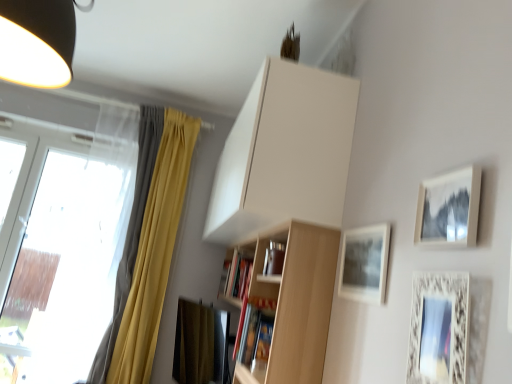
Question: Is white ornate picture frame at lower right, which is the third picture frame from back to front, wider or thinner than yellow fabric curtain at left?

Choices:
 (A) thin
 (B) wide

Answer: (A)

Question: Considering their positions, is white ornate picture frame at lower right, which is the third picture frame from back to front, located in front of or behind yellow fabric curtain at left?

Choices:
 (A) front
 (B) behind

Answer: (A)

Question: Based on their relative distances, which object is nearer to the white ornate picture frame at lower right, which appears as the first picture frame when viewed from the front?

Choices:
 (A) hardcover book at center, arranged as the 2th book when viewed from the front
 (B) transparent glass window at left
 (C) white matte cabinet at upper center
 (D) yellow fabric curtain at left
 (E) matte white picture frame at upper right, which is the 2th picture frame in front-to-back order

Answer: (E)

Question: Estimate the real-world distances between objects in this image. Which object is closer to the yellow fabric curtain at left?

Choices:
 (A) matte gray picture frame at upper right, the 3th picture frame in the front-to-back sequence
 (B) hardcover book at center, the second book when ordered from back to front
 (C) matte white picture frame at upper right, which is the 2th picture frame in front-to-back order
 (D) transparent glass window at left
 (E) hardcover book at center, arranged as the 2th book when viewed from the front

Answer: (D)